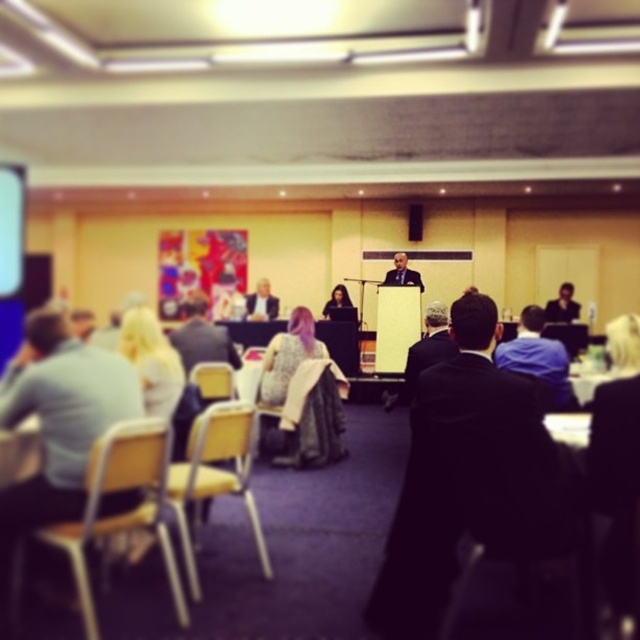
Between yellow plastic chair at lower left and smooth black suit at right, which one appears on the left side from the viewer's perspective?

yellow plastic chair at lower left

Does yellow plastic chair at lower left come behind smooth black suit at right?

No.

This screenshot has width=640, height=640. What do you see at coordinates (216, 474) in the screenshot? I see `yellow plastic chair at lower left` at bounding box center [216, 474].

Locate an element on the screen. yellow plastic chair at lower left is located at coordinates (216, 474).

Who is lower down, light blue fabric shirt at left or smooth black suit at right?

light blue fabric shirt at left is below.

Does light blue fabric shirt at left have a smaller size compared to smooth black suit at right?

Yes.

Locate an element on the screen. This screenshot has height=640, width=640. light blue fabric shirt at left is located at coordinates coord(58,422).

Is blonde hair at left taller than matte black dress at center?

Yes.

Identify the location of blonde hair at left. Image resolution: width=640 pixels, height=640 pixels. (150, 360).

Locate an element on the screen. blonde hair at left is located at coordinates (150, 360).